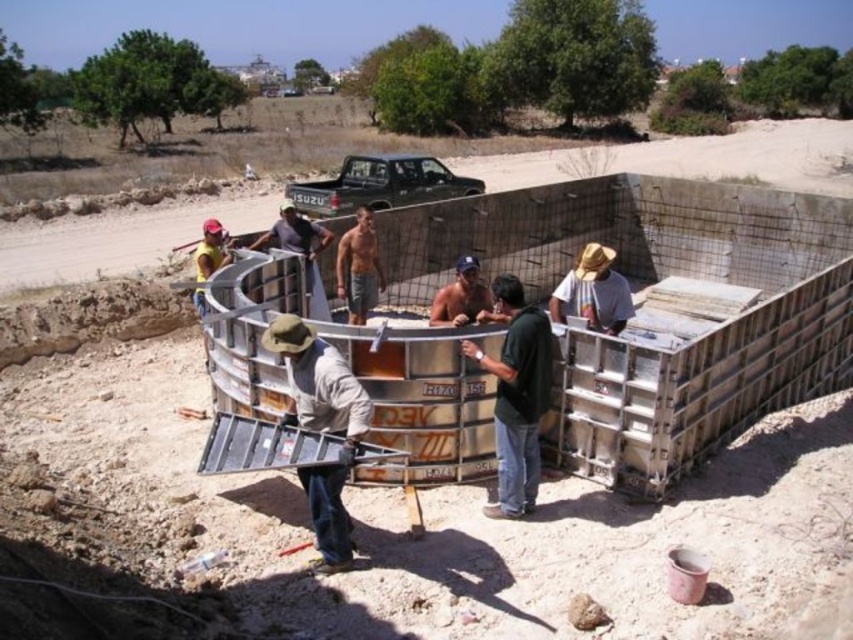
You are a safety inspector at the construction site. You notice the green matte shirt at center and the shiny metallic helmet at center. According to safety protocols, which object should be positioned closer to the workers for compliance?

The shiny metallic helmet at center should be positioned closer to the workers because the green matte shirt at center is currently in front of it, which might obstruct access to the helmet. Safety gear like helmets should always be readily accessible.

You are standing at the construction site and want to reach the point marked as point [358,397]. If you walk straight ahead, will you reach it within 5 meters?

The point [358,397] is 5.19 meters away from the viewer, so walking straight ahead will not reach it within 5 meters.